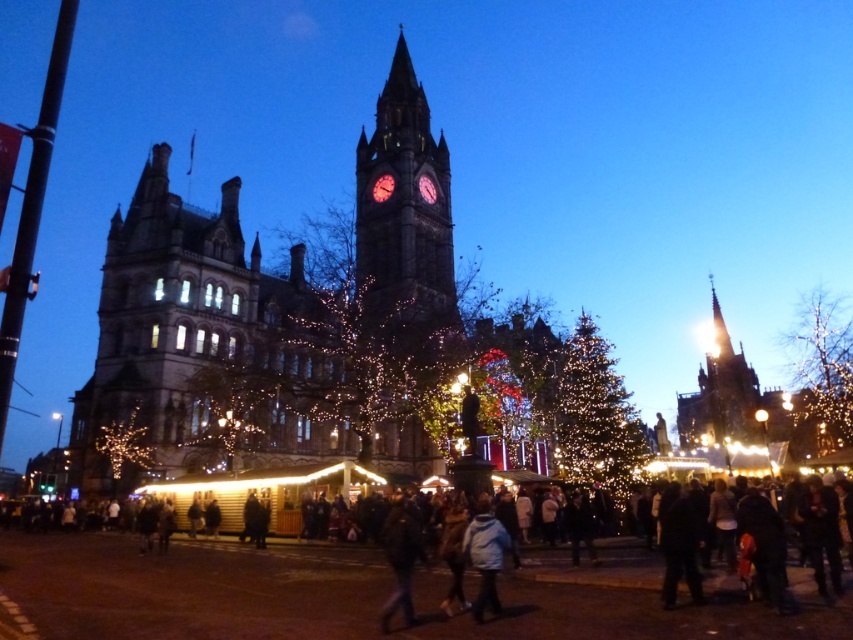
Is point (386, 252) positioned after point (733, 435)?

No, (386, 252) is in front of (733, 435).

Is polished stone clock tower at center in front of shiny gold spire at center right?

Yes.

You are a GUI agent. You are given a task and a screenshot of the screen. Output one action in this format:
    pyautogui.click(x=<x>, y=<y>)
    Task: Click on the polished stone clock tower at center
    
    Given the screenshot: What is the action you would take?
    pyautogui.click(x=405, y=225)